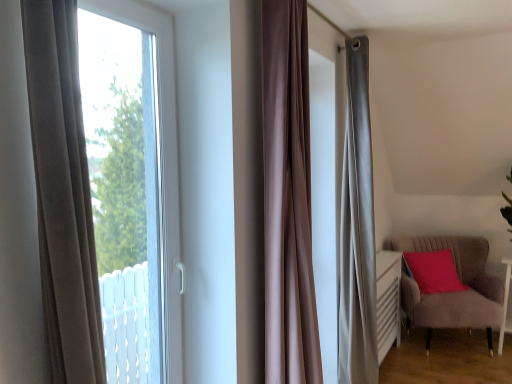
Question: Based on their positions, is satin brown curtain at center located to the left or right of velvet grey armchair at lower right?

Choices:
 (A) left
 (B) right

Answer: (A)

Question: In terms of width, does satin brown curtain at center look wider or thinner when compared to velvet grey armchair at lower right?

Choices:
 (A) wide
 (B) thin

Answer: (B)

Question: Estimate the real-world distances between objects in this image. Which object is closer to the white glossy side table at lower right?

Choices:
 (A) transparent glass window at left
 (B) matte pink cushion at right
 (C) velvet grey armchair at lower right
 (D) satin brown curtain at center

Answer: (C)

Question: Which is farther from the transparent glass window at left?

Choices:
 (A) velvet grey armchair at lower right
 (B) matte pink cushion at right
 (C) satin brown curtain at center
 (D) white glossy side table at lower right

Answer: (D)